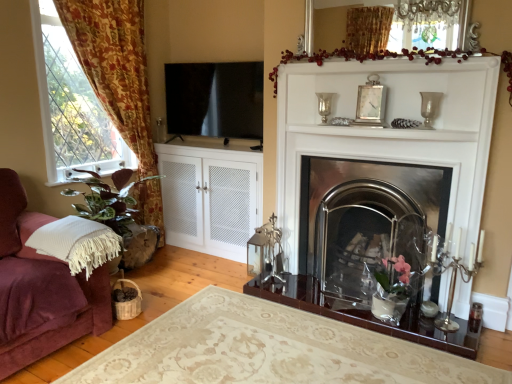
Identify the location of vacant area situated below silver metallic candle holder at right, which is counted as the third candle holder, starting from the top (from a real-world perspective). The width and height of the screenshot is (512, 384). (453, 319).